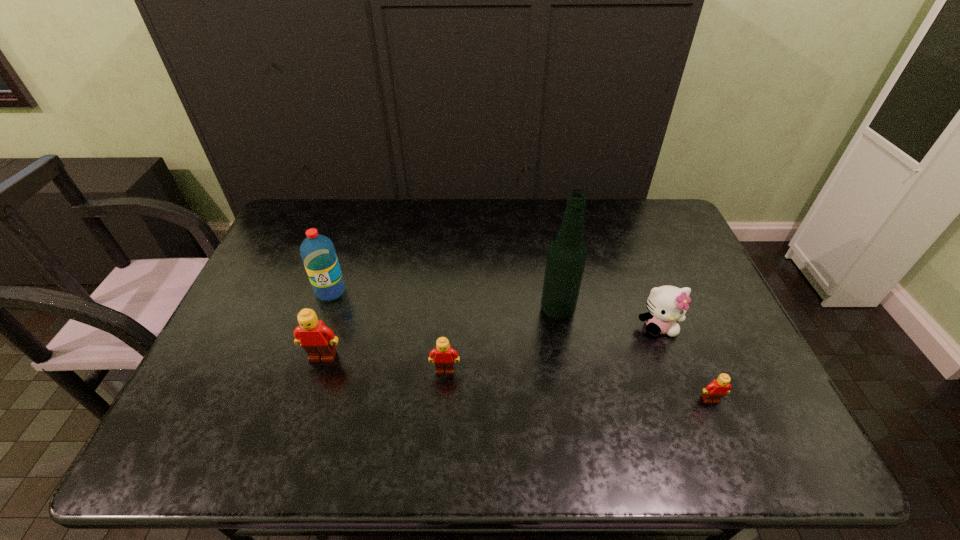
This screenshot has width=960, height=540. I want to click on vacant position at the near edge of the desktop, so click(x=449, y=384).

In the image, there is a desktop. Where is `vacant region at the left edge`? Image resolution: width=960 pixels, height=540 pixels. vacant region at the left edge is located at coordinates (263, 267).

Where is `free space at the near right corner of the desktop`? free space at the near right corner of the desktop is located at coordinates (760, 393).

The image size is (960, 540). What are the coordinates of `free space between the shortest Lego and the fourth object from left to right` in the screenshot? It's located at (634, 355).

This screenshot has height=540, width=960. What are the coordinates of `unoccupied area between the fifth tallest object and the nearest object` in the screenshot? It's located at (578, 385).

Where is `vacant area that lies between the kitten and the second nearest object`? Image resolution: width=960 pixels, height=540 pixels. vacant area that lies between the kitten and the second nearest object is located at coordinates tap(552, 348).

In order to click on empty location between the shortest Lego and the fifth shortest object in this screenshot , I will do `click(520, 346)`.

In order to click on vacant space that is in between the second tallest Lego and the shortest object in this screenshot , I will do `click(578, 385)`.

Find the location of a particular element. The height and width of the screenshot is (540, 960). blank region between the kitten and the second farthest Lego is located at coordinates pyautogui.click(x=552, y=348).

Find the location of a particular element. free area in between the second nearest Lego and the kitten is located at coordinates (552, 348).